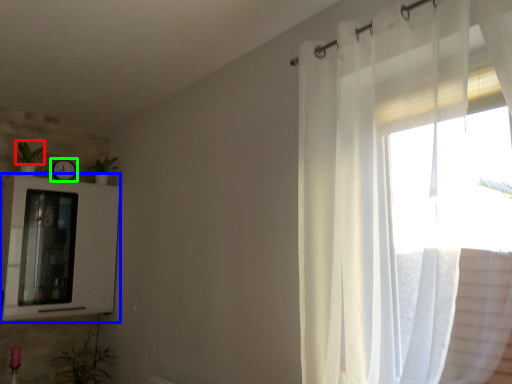
Question: Considering the real-world distances, which object is closest to plant (highlighted by a red box)? medicine cabinet (highlighted by a blue box) or clock (highlighted by a green box).

Choices:
 (A) medicine cabinet
 (B) clock

Answer: (B)